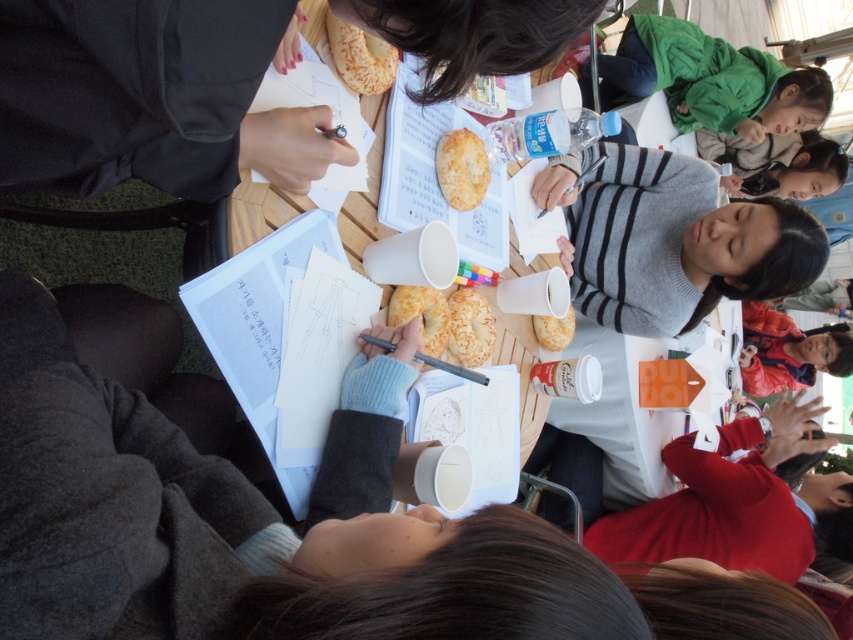
Question: Estimate the real-world distances between objects in this image. Which object is closer to the golden brown bread at center?

Choices:
 (A) golden flaky pastry at upper center
 (B) golden flaky pastry at center
 (C) golden crumbly pastry at center
 (D) gray striped sweater at upper center

Answer: (C)

Question: Is wooden table at center to the left of golden crumbly pastry at center from the viewer's perspective?

Choices:
 (A) yes
 (B) no

Answer: (A)

Question: In this image, where is golden flaky pastry at upper center located relative to golden flaky pastry at center?

Choices:
 (A) below
 (B) above

Answer: (B)

Question: Among these points, which one is farthest from the camera?

Choices:
 (A) [447, 51]
 (B) [643, 316]

Answer: (B)

Question: Is wooden table at center behind green fuzzy jacket at upper right?

Choices:
 (A) no
 (B) yes

Answer: (A)

Question: Among these points, which one is farthest from the camera?

Choices:
 (A) (767, 353)
 (B) (566, 321)
 (C) (456, 148)
 (D) (293, 28)

Answer: (A)